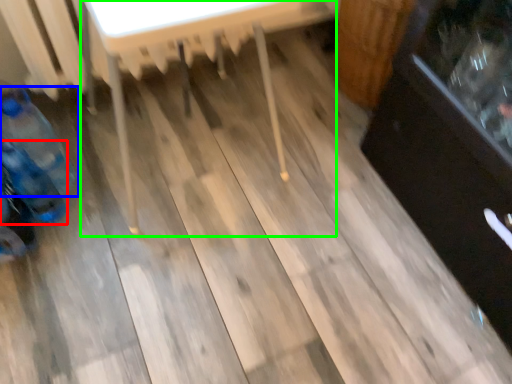
Question: Which object is positioned closest to bottle (highlighted by a red box)? Select from bottle (highlighted by a blue box) and table (highlighted by a green box).

Choices:
 (A) bottle
 (B) table

Answer: (A)